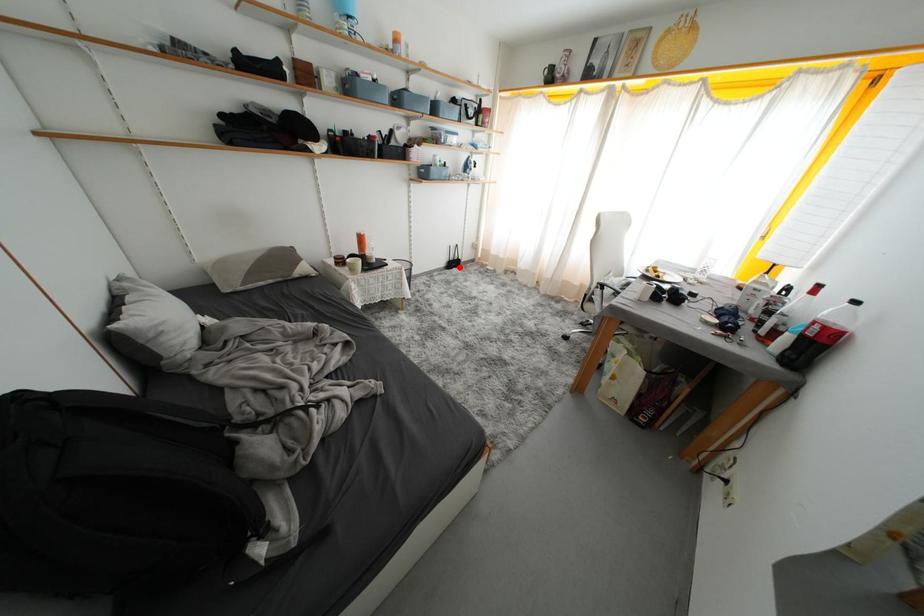
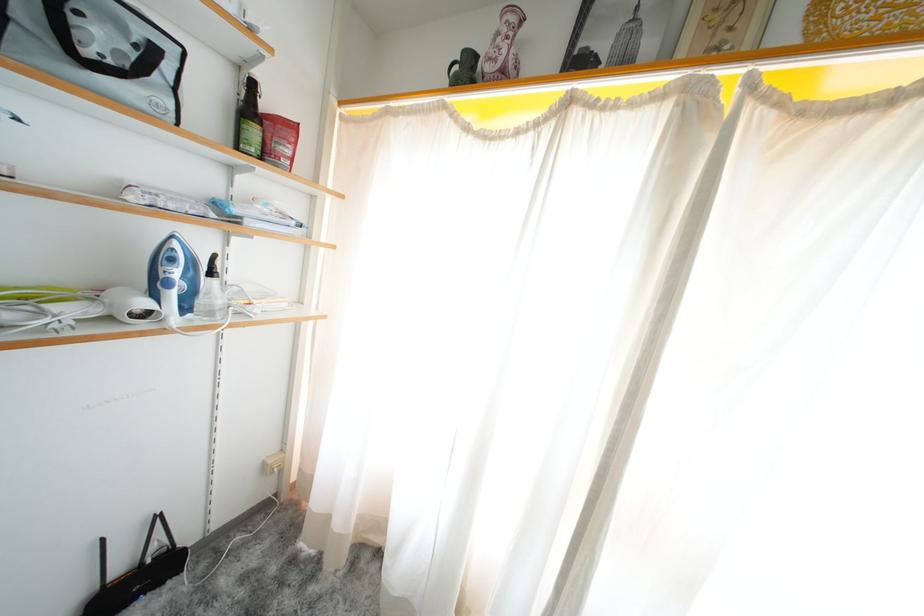
Locate, in the second image, the point that corresponds to the highlighted location in the first image.

(143, 586)